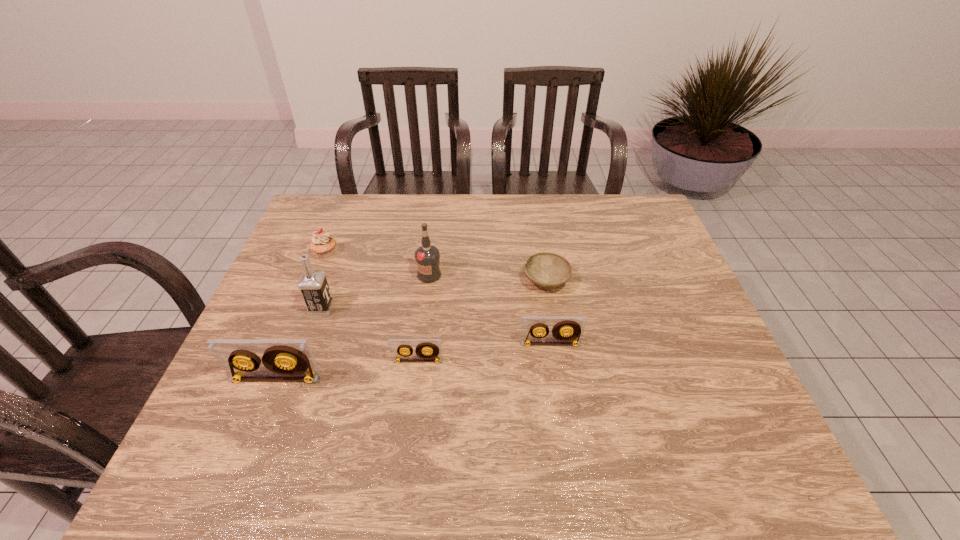
At what (x,y) coordinates should I click in order to perform the action: click on free spot that satisfies the following two spatial constraints: 1. on the front label of the nearer vodka; 2. at the front of the fifth shortest object with visible reels. Please return your answer as a coordinate pair (x, y). This screenshot has width=960, height=540. Looking at the image, I should click on (296, 379).

Find the location of a particular element. The width and height of the screenshot is (960, 540). vacant space that satisfies the following two spatial constraints: 1. on the front label of the fourth nearest object; 2. at the front of the nearest videotape with visible reels is located at coordinates (296, 379).